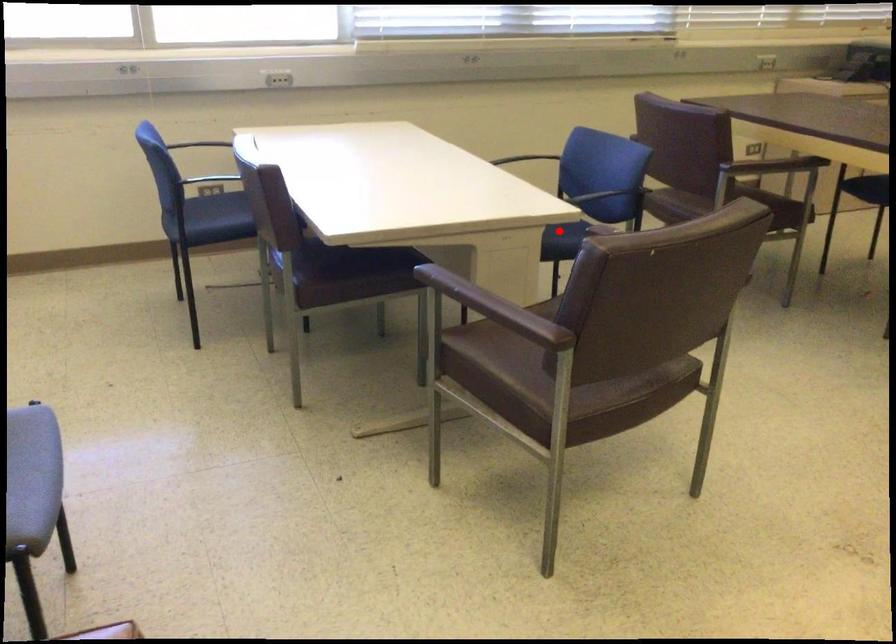
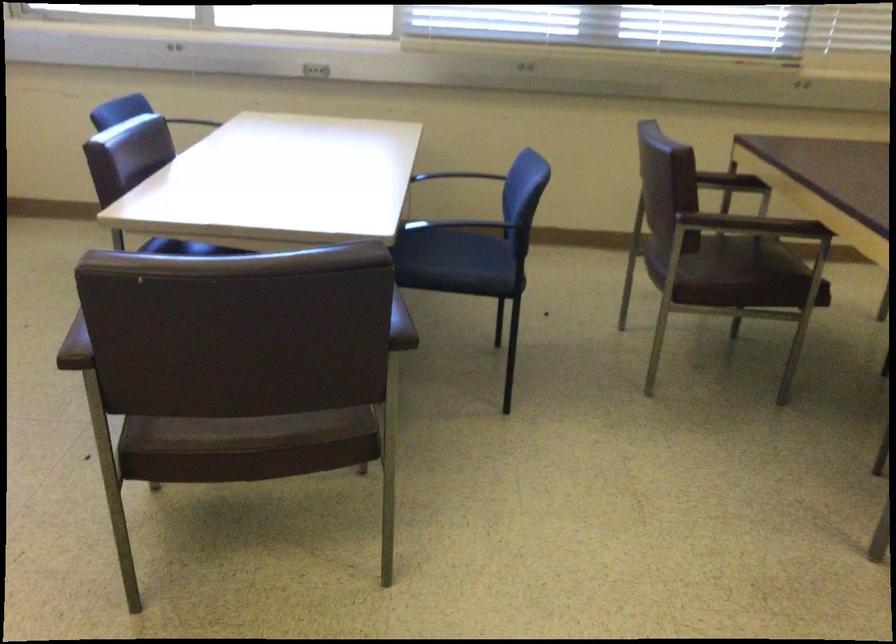
The point at the highlighted location is marked in the first image. Where is the corresponding point in the second image?

(458, 261)